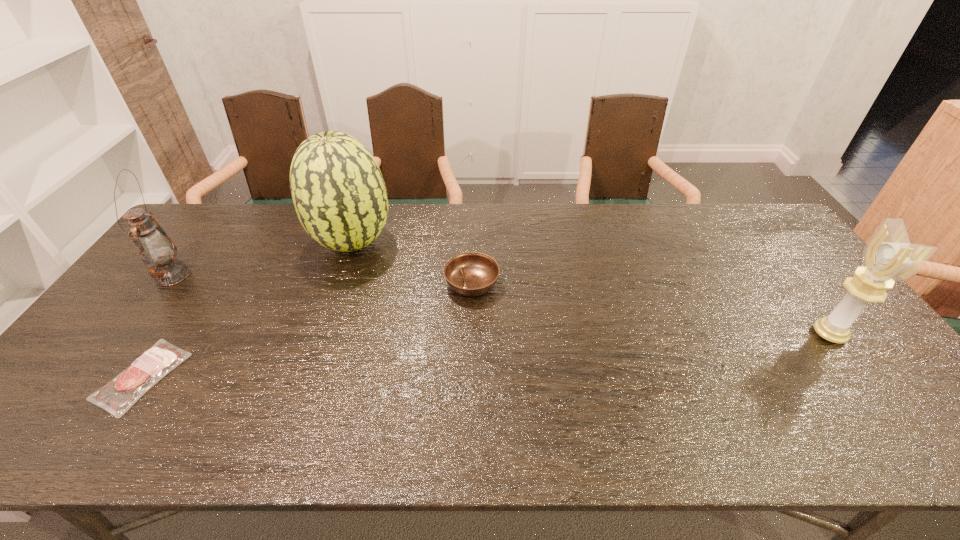
Identify the location of vacant area between the rightmost object and the third object from right to left. The image size is (960, 540). (590, 288).

Image resolution: width=960 pixels, height=540 pixels. I want to click on free space between the steak and the third object from left to right, so (248, 309).

Where is `free space between the steak and the fourth tallest object`? This screenshot has width=960, height=540. free space between the steak and the fourth tallest object is located at coordinates (307, 330).

Locate which object ranks second in proximity to the shortest object. Please provide its 2D coordinates. Your answer should be formatted as a tuple, i.e. [(x, y)], where the tuple contains the x and y coordinates of a point satisfying the conditions above.

[(339, 194)]

Find the location of a particular element. The image size is (960, 540). the second closest object to the steak is located at coordinates (339, 194).

At what (x,y) coordinates should I click in order to perform the action: click on free space that satisfies the following two spatial constraints: 1. on the front side of the second shortest object; 2. on the right side of the oil lamp. Please return your answer as a coordinate pair (x, y). The width and height of the screenshot is (960, 540). Looking at the image, I should click on (167, 284).

What are the coordinates of `vacant space that satisfies the following two spatial constraints: 1. on the back side of the steak; 2. on the left side of the second object from right to left` in the screenshot? It's located at (204, 284).